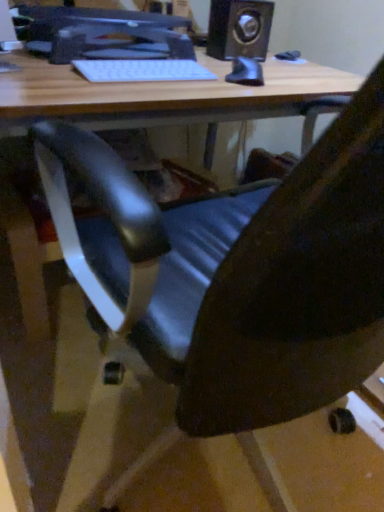
Locate an element on the screen. The width and height of the screenshot is (384, 512). vacant region in front of white matte keyboard at upper center is located at coordinates (98, 94).